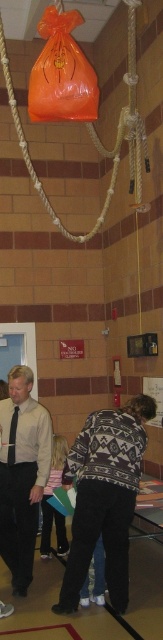
Locate an element on the screen. matte black shirt at center is located at coordinates (22, 474).

Is matte black shirt at center further to the viewer compared to orange plastic bag at upper center?

Yes, it is behind orange plastic bag at upper center.

Is point (13, 544) positioned before point (37, 120)?

That is False.

This screenshot has height=640, width=163. Find the location of `matte black shirt at center`. matte black shirt at center is located at coordinates (22, 474).

Based on the photo, can you confirm if knit sweater at center is positioned above orange plastic bag at upper center?

Incorrect, knit sweater at center is not positioned above orange plastic bag at upper center.

Image resolution: width=163 pixels, height=640 pixels. Identify the location of knit sweater at center. (104, 497).

The image size is (163, 640). In order to click on knit sweater at center in this screenshot , I will do `click(104, 497)`.

Who is positioned more to the left, knit sweater at center or matte black shirt at center?

matte black shirt at center is more to the left.

Can you confirm if knit sweater at center is positioned to the left of matte black shirt at center?

No, knit sweater at center is not to the left of matte black shirt at center.

Does point (63, 579) come behind point (7, 448)?

Yes, it is behind point (7, 448).

The width and height of the screenshot is (163, 640). Identify the location of knit sweater at center. (104, 497).